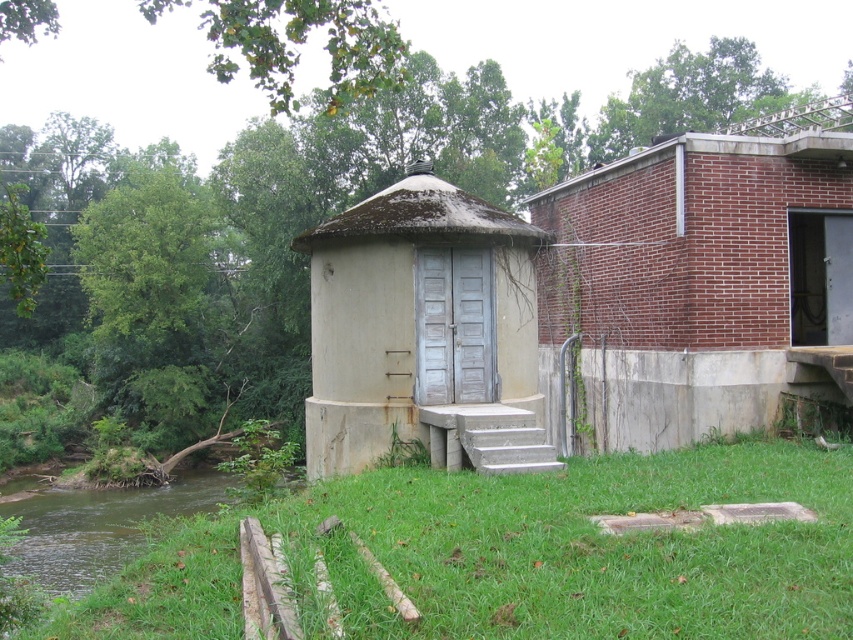
Can you confirm if brick wall at right is taller than concrete/steps at lower center?

Yes.

Does point (709, 192) lie behind point (490, 440)?

Yes, point (709, 192) is behind point (490, 440).

Locate an element on the screen. This screenshot has height=640, width=853. brick wall at right is located at coordinates (699, 282).

Between green grass at lower center and light gray concrete hut at center, which one appears on the left side from the viewer's perspective?

light gray concrete hut at center is more to the left.

The width and height of the screenshot is (853, 640). I want to click on green grass at lower center, so click(x=584, y=548).

Is green grass at lower center wider than concrete/steps at lower center?

No.

Who is positioned more to the right, green grass at lower center or concrete/steps at lower center?

green grass at lower center

Who is more forward, (827, 506) or (502, 454)?

Point (827, 506) is in front.

Locate an element on the screen. green grass at lower center is located at coordinates click(584, 548).